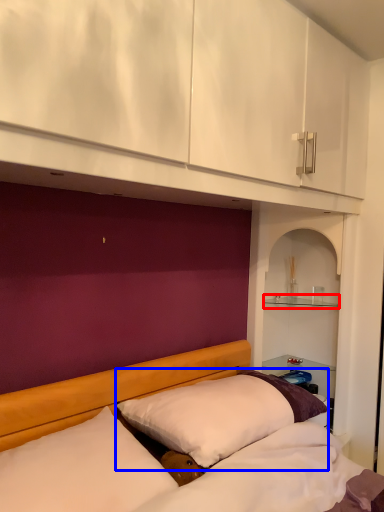
Question: Which object appears closest to the camera in this image, shelf (highlighted by a red box) or pillow (highlighted by a blue box)?

Choices:
 (A) shelf
 (B) pillow

Answer: (B)